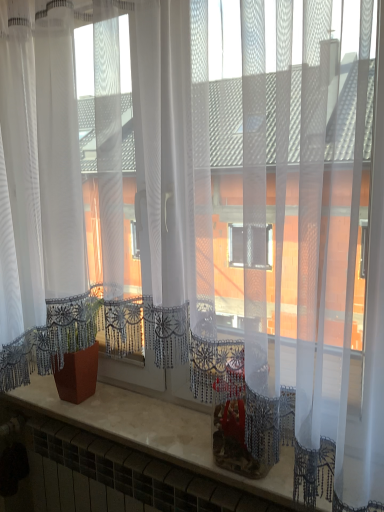
Question: From a real-world perspective, is matte terracotta pot at lower left physically located above or below marble counter top at center?

Choices:
 (A) above
 (B) below

Answer: (A)

Question: Considering the positions of matte terracotta pot at lower left and marble counter top at center in the image, is matte terracotta pot at lower left wider or thinner than marble counter top at center?

Choices:
 (A) wide
 (B) thin

Answer: (B)

Question: Is matte terracotta pot at lower left in front of or behind marble counter top at center in the image?

Choices:
 (A) behind
 (B) front

Answer: (A)

Question: In terms of width, does marble counter top at center look wider or thinner when compared to matte terracotta pot at lower left?

Choices:
 (A) thin
 (B) wide

Answer: (B)

Question: From their relative heights in the image, would you say marble counter top at center is taller or shorter than matte terracotta pot at lower left?

Choices:
 (A) short
 (B) tall

Answer: (A)

Question: Relative to matte terracotta pot at lower left, is marble counter top at center in front or behind?

Choices:
 (A) front
 (B) behind

Answer: (A)

Question: From the image's perspective, is marble counter top at center above or below matte terracotta pot at lower left?

Choices:
 (A) below
 (B) above

Answer: (A)